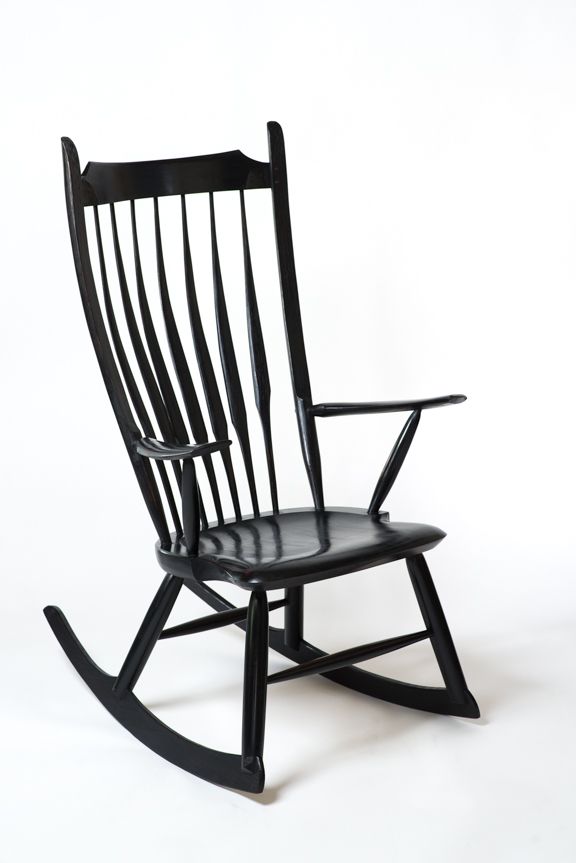
Where is `arm supports`? This screenshot has width=576, height=863. arm supports is located at coordinates (196, 511), (392, 471).